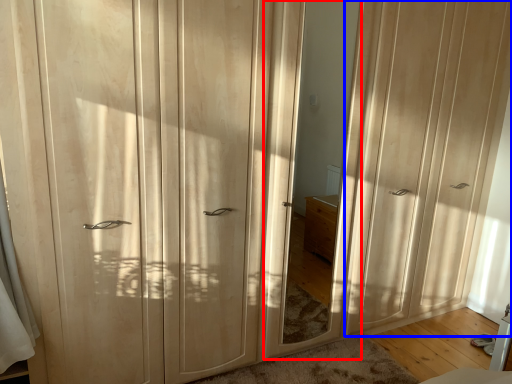
Question: Which point is further to the camera, mirror (highlighted by a red box) or screen door (highlighted by a blue box)?

Choices:
 (A) mirror
 (B) screen door

Answer: (B)